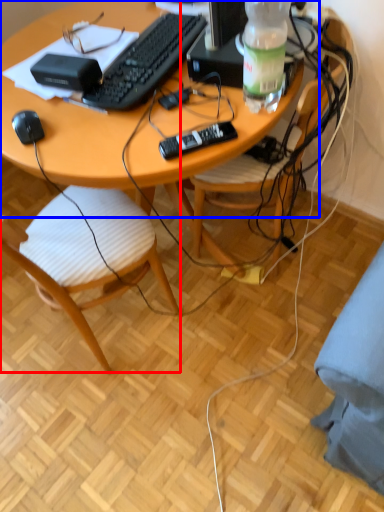
Question: Among these objects, which one is farthest to the camera, chair (highlighted by a red box) or desk (highlighted by a blue box)?

Choices:
 (A) chair
 (B) desk

Answer: (B)